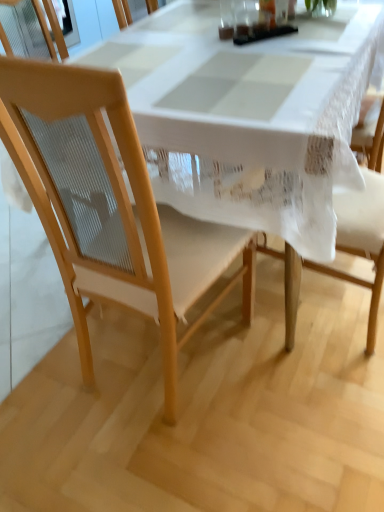
Where is `free space in front of light wood chair at center`? free space in front of light wood chair at center is located at coordinates (171, 456).